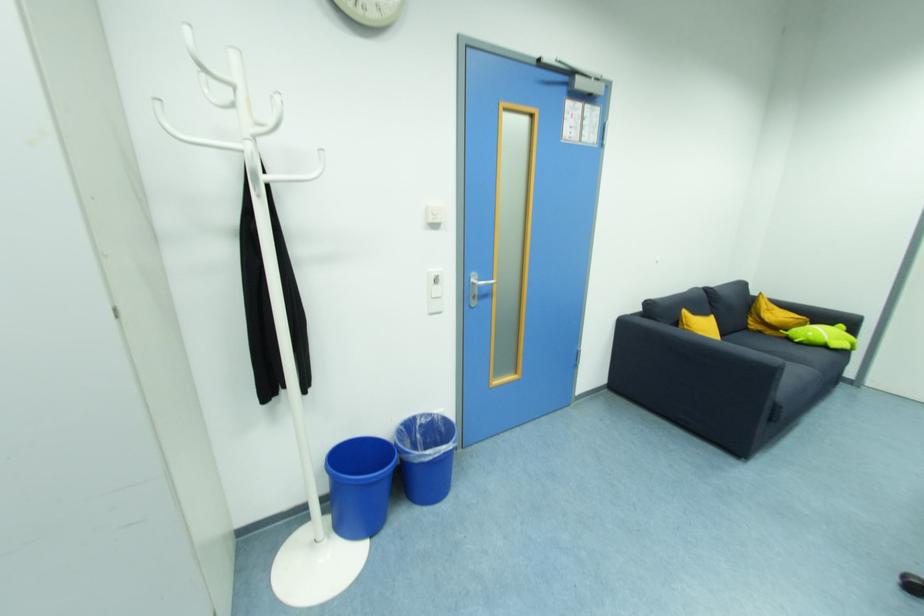
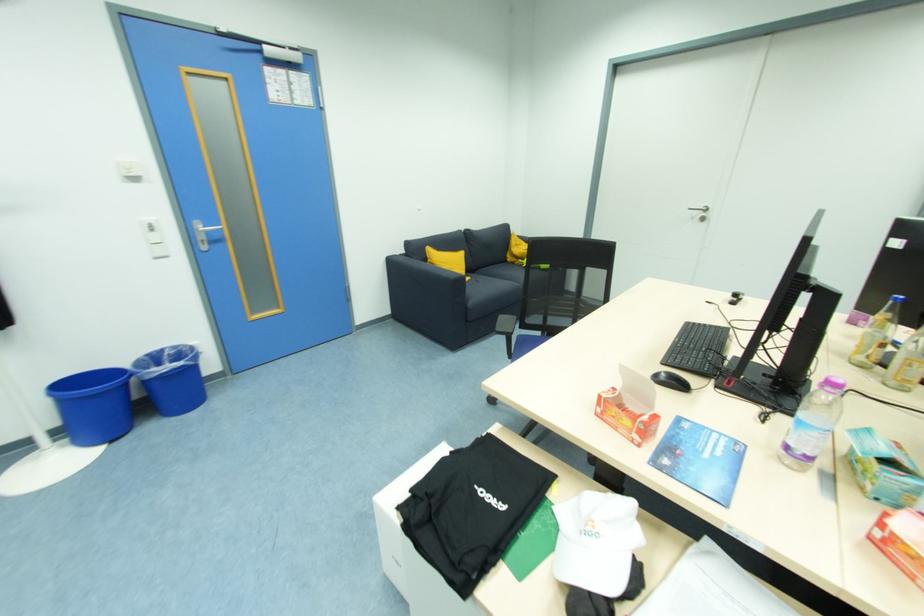
Find the pixel in the second image that matches pixel 791 336 in the first image.

(526, 264)